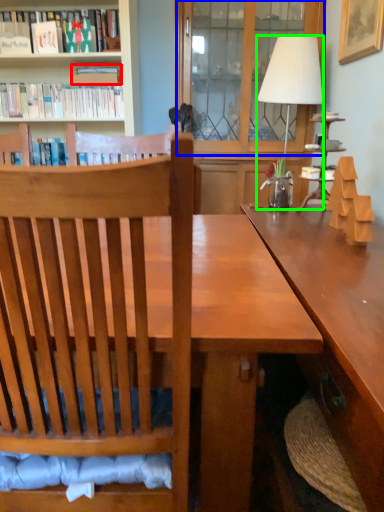
Question: Which object is the closest to the book (highlighted by a red box)? Choose among these: glass door (highlighted by a blue box) or lamp (highlighted by a green box).

Choices:
 (A) glass door
 (B) lamp

Answer: (A)